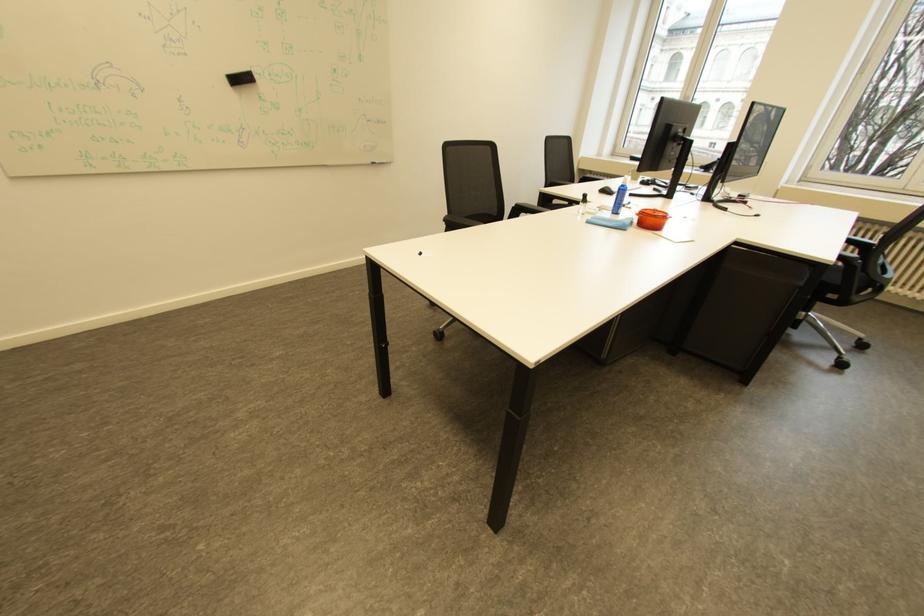
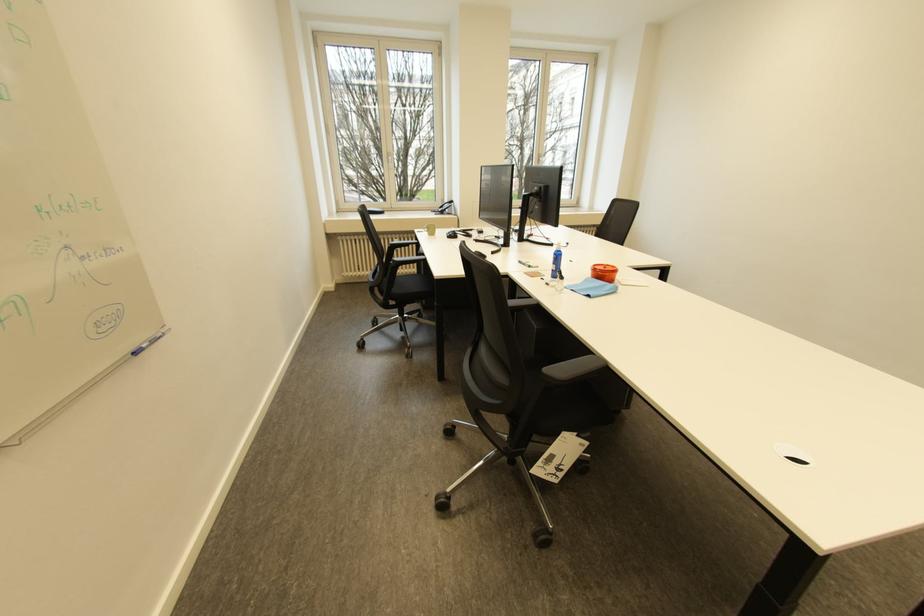
Question: I am providing you with two images of the same scene from different viewpoints. Which of the following objects are not visible in image2?

Choices:
 (A) phone handset
 (B) chair armrest
 (C) microphone on stand
 (D) pair of glasses

Answer: (B)